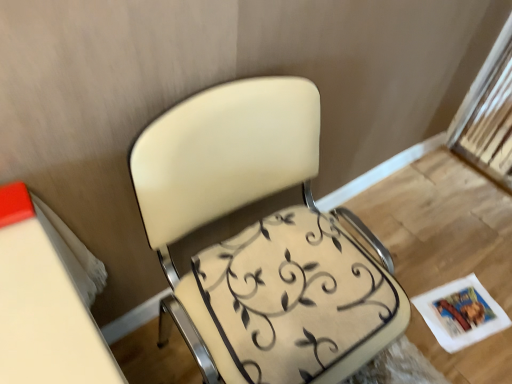
The height and width of the screenshot is (384, 512). What do you see at coordinates (261, 239) in the screenshot?
I see `matte cream chair at center` at bounding box center [261, 239].

The width and height of the screenshot is (512, 384). I want to click on white paper magazine at lower right, so click(x=461, y=313).

Is white paper magazine at lower right far from beige fabric swivel chair at center?

That's not correct — white paper magazine at lower right is a little close to beige fabric swivel chair at center.

Does white paper magazine at lower right lie behind beige fabric swivel chair at center?

Yes, it is.

Is beige fabric swivel chair at center at the back of white paper magazine at lower right?

No, white paper magazine at lower right is not facing away from beige fabric swivel chair at center.

Which is more to the left, white paper magazine at lower right or matte cream chair at center?

matte cream chair at center.

Between white paper magazine at lower right and matte cream chair at center, which one has smaller size?

white paper magazine at lower right is smaller.

Considering the positions of point (441, 325) and point (269, 279), is point (441, 325) closer or farther from the camera than point (269, 279)?

Point (441, 325) is farther from the camera than point (269, 279).

Is matte cream chair at center completely or partially inside white paper magazine at lower right?

That's incorrect, matte cream chair at center is not inside white paper magazine at lower right.

Which object is closer to the camera taking this photo, beige fabric swivel chair at center or matte cream chair at center?

Positioned in front is matte cream chair at center.

The height and width of the screenshot is (384, 512). What are the coordinates of `chair on the left of beige fabric swivel chair at center` in the screenshot? It's located at (261, 239).

Is beige fabric swivel chair at center taller or shorter than matte cream chair at center?

beige fabric swivel chair at center is shorter than matte cream chair at center.

Is beige fabric swivel chair at center positioned beyond the bounds of matte cream chair at center?

No, beige fabric swivel chair at center is inside matte cream chair at center's boundary.

Considering their positions, is matte cream chair at center located in front of or behind white paper magazine at lower right?

matte cream chair at center is positioned closer to the viewer than white paper magazine at lower right.

Is matte cream chair at center facing towards white paper magazine at lower right?

No, matte cream chair at center does not turn towards white paper magazine at lower right.

Is matte cream chair at center outside of white paper magazine at lower right?

Absolutely, matte cream chair at center is external to white paper magazine at lower right.

Considering the sizes of objects matte cream chair at center and white paper magazine at lower right in the image provided, who is taller, matte cream chair at center or white paper magazine at lower right?

Standing taller between the two is matte cream chair at center.

From the image's perspective, which one is positioned lower, matte cream chair at center or beige fabric swivel chair at center?

beige fabric swivel chair at center is shown below in the image.

In the image, is matte cream chair at center positioned in front of or behind beige fabric swivel chair at center?

matte cream chair at center is in front of beige fabric swivel chair at center.

From a real-world perspective, does matte cream chair at center stand above beige fabric swivel chair at center?

Incorrect, from a real-world perspective, matte cream chair at center is lower than beige fabric swivel chair at center.

In terms of height, does beige fabric swivel chair at center look taller or shorter compared to white paper magazine at lower right?

In the image, beige fabric swivel chair at center appears to be taller than white paper magazine at lower right.

Is the surface of beige fabric swivel chair at center in direct contact with white paper magazine at lower right?

No, beige fabric swivel chair at center is not beside white paper magazine at lower right.

Identify the location of magazine on the right of beige fabric swivel chair at center. (461, 313).

How many degrees apart are the facing directions of beige fabric swivel chair at center and white paper magazine at lower right?

beige fabric swivel chair at center and white paper magazine at lower right are facing 1.46 degrees away from each other.

Where is `swivel chair above the white paper magazine at lower right (from the image's perspective)`? The width and height of the screenshot is (512, 384). swivel chair above the white paper magazine at lower right (from the image's perspective) is located at coordinates (298, 299).

Where is `chair in front of the white paper magazine at lower right`? The width and height of the screenshot is (512, 384). chair in front of the white paper magazine at lower right is located at coordinates (261, 239).

Estimate the real-world distances between objects in this image. Which object is closer to beige fabric swivel chair at center, white paper magazine at lower right or matte cream chair at center?

Among the two, matte cream chair at center is located nearer to beige fabric swivel chair at center.

From the image, which object appears to be nearer to matte cream chair at center, white paper magazine at lower right or beige fabric swivel chair at center?

The object closer to matte cream chair at center is beige fabric swivel chair at center.

When comparing their distances from white paper magazine at lower right, does matte cream chair at center or beige fabric swivel chair at center seem closer?

Among the two, beige fabric swivel chair at center is located nearer to white paper magazine at lower right.

Estimate the real-world distances between objects in this image. Which object is closer to white paper magazine at lower right, beige fabric swivel chair at center or matte cream chair at center?

Among the two, beige fabric swivel chair at center is located nearer to white paper magazine at lower right.

When comparing their distances from beige fabric swivel chair at center, does matte cream chair at center or white paper magazine at lower right seem further?

white paper magazine at lower right is further to beige fabric swivel chair at center.

Looking at the image, which one is located closer to matte cream chair at center, beige fabric swivel chair at center or white paper magazine at lower right?

Based on the image, beige fabric swivel chair at center appears to be nearer to matte cream chair at center.

Find the location of a particular element. swivel chair located between matte cream chair at center and white paper magazine at lower right in the depth direction is located at coordinates (298, 299).